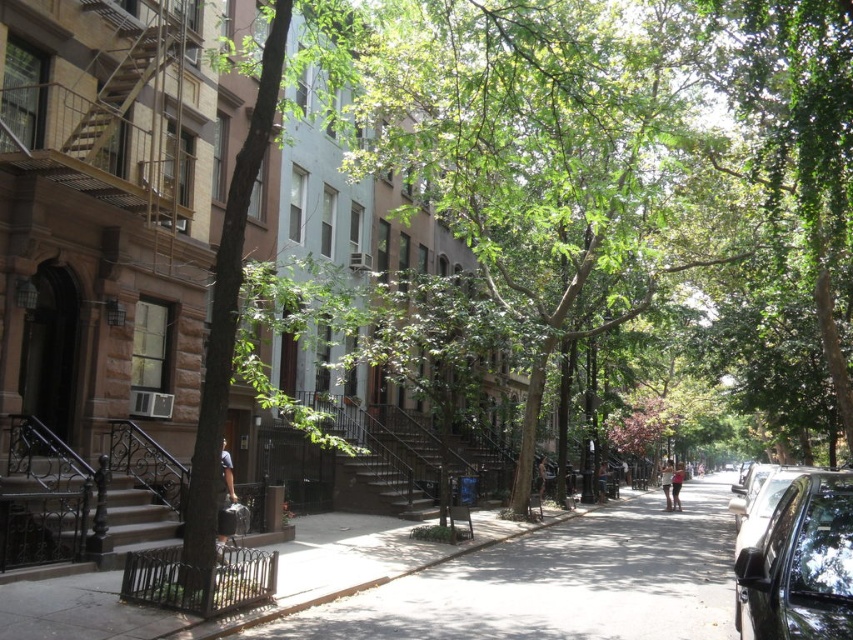
Question: Which of the following is the farthest from the observer?

Choices:
 (A) metallic wrought iron stairs at left
 (B) black wrought iron stairs at center
 (C) smooth concrete sidewalk at center

Answer: (B)

Question: Does metallic wrought iron stairs at left appear under shiny silver car at right?

Choices:
 (A) yes
 (B) no

Answer: (B)

Question: Can you confirm if metallic wrought iron stairs at left is positioned to the left of shiny black car at right?

Choices:
 (A) yes
 (B) no

Answer: (A)

Question: Considering the relative positions of smooth concrete sidewalk at center and shiny silver car at right in the image provided, where is smooth concrete sidewalk at center located with respect to shiny silver car at right?

Choices:
 (A) below
 (B) above

Answer: (B)

Question: Which object is closer to the camera taking this photo?

Choices:
 (A) metallic silver fire escape at upper left
 (B) black glossy car at right

Answer: (B)

Question: Which object is closer to the camera taking this photo?

Choices:
 (A) smooth concrete sidewalk at center
 (B) metallic wrought iron stairs at left
 (C) black wrought iron stairs at center

Answer: (A)